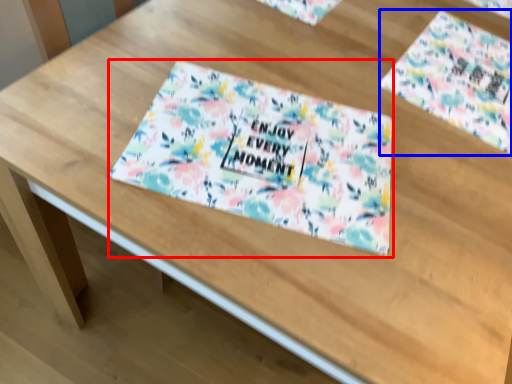
Question: Which of the following is the closest to the observer, tablecloth (highlighted by a red box) or flyer (highlighted by a blue box)?

Choices:
 (A) tablecloth
 (B) flyer

Answer: (A)